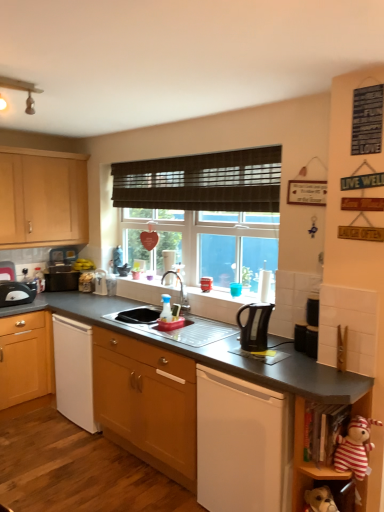
How much space does black plastic toaster at left, the 1th kitchen appliance in the back-to-front sequence, occupy horizontally?

black plastic toaster at left, the 1th kitchen appliance in the back-to-front sequence, is 7.88 inches in width.

This screenshot has height=512, width=384. I want to click on black plastic toaster at left, which ranks as the second kitchen appliance in front-to-back order, so click(16, 293).

The height and width of the screenshot is (512, 384). I want to click on black plastic toaster at left, which ranks as the first appliance in left-to-right order, so click(x=61, y=278).

The image size is (384, 512). Describe the element at coordinates (303, 444) in the screenshot. I see `wooden shelf at lower right, which appears as the second shelf when ordered from the bottom` at that location.

Describe the element at coordinates (242, 444) in the screenshot. I see `black plastic kettle at center` at that location.

This screenshot has width=384, height=512. What do you see at coordinates (355, 447) in the screenshot? I see `striped fabric stuffed animal at lower right` at bounding box center [355, 447].

Find the location of `wooden cabinet at center, the first cabinetry in the bottom-to-top sequence`. wooden cabinet at center, the first cabinetry in the bottom-to-top sequence is located at coordinates (147, 402).

The height and width of the screenshot is (512, 384). I want to click on black plastic toaster at left, which ranks as the second kitchen appliance in front-to-back order, so click(16, 293).

How different are the orientations of black plastic toaster at left, which ranks as the 2th kitchen appliance in right-to-left order, and striped fabric stuffed animal at lower right, which is the 1th shelf from bottom to top, in degrees?

89.5 degrees.

In terms of height, does black plastic toaster at left, which ranks as the second kitchen appliance in front-to-back order, look taller or shorter compared to striped fabric stuffed animal at lower right, which ranks as the 2th shelf in top-to-bottom order?

Considering their sizes, black plastic toaster at left, which ranks as the second kitchen appliance in front-to-back order, has less height than striped fabric stuffed animal at lower right, which ranks as the 2th shelf in top-to-bottom order.

From the striped fabric stuffed animal at lower right, which ranks as the 2th shelf in top-to-bottom order, count 2nd kitchen appliances backward and point to it. Please provide its 2D coordinates.

[(16, 293)]

Considering the positions of point (18, 287) and point (337, 483), is point (18, 287) closer or farther from the camera than point (337, 483)?

Point (18, 287).

From a real-world perspective, is brown woven blind at center above or below black plastic toaster at left, which ranks as the 2th kitchen appliance in right-to-left order?

brown woven blind at center is above black plastic toaster at left, which ranks as the 2th kitchen appliance in right-to-left order.

Is brown woven blind at center in contact with black plastic toaster at left, which ranks as the second kitchen appliance in front-to-back order?

There is a gap between brown woven blind at center and black plastic toaster at left, which ranks as the second kitchen appliance in front-to-back order.

Is brown woven blind at center taller or shorter than black plastic toaster at left, the 1th kitchen appliance in the back-to-front sequence?

Considering their sizes, brown woven blind at center has more height than black plastic toaster at left, the 1th kitchen appliance in the back-to-front sequence.

Is silver metallic tap at center wider than black plastic kettle at center, marked as the 1th kitchen appliance in a right-to-left arrangement?

Incorrect, the width of silver metallic tap at center does not surpass that of black plastic kettle at center, marked as the 1th kitchen appliance in a right-to-left arrangement.

Looking at the image, does silver metallic tap at center seem bigger or smaller compared to black plastic kettle at center, marked as the 1th kitchen appliance in a right-to-left arrangement?

Clearly, silver metallic tap at center is larger in size than black plastic kettle at center, marked as the 1th kitchen appliance in a right-to-left arrangement.

Considering the relative positions of silver metallic tap at center and black plastic kettle at center, the second kitchen appliance positioned from the back, in the image provided, is silver metallic tap at center to the right of black plastic kettle at center, the second kitchen appliance positioned from the back, from the viewer's perspective?

No.

Is point (295, 339) closer to camera compared to point (300, 488)?

No, it is behind (300, 488).

Is black plastic kettle at center, which is counted as the 1th appliance, starting from the right, positioned with its back to striped fabric stuffed animal at lower right, which ranks as the 2th shelf in top-to-bottom order?

black plastic kettle at center, which is counted as the 1th appliance, starting from the right, is not turned away from striped fabric stuffed animal at lower right, which ranks as the 2th shelf in top-to-bottom order.

Is black plastic kettle at center, which is counted as the 1th appliance, starting from the right, positioned behind striped fabric stuffed animal at lower right, which ranks as the 2th shelf in top-to-bottom order?

Yes.

From a real-world perspective, which shelf is the 2nd one underneath the black plastic kettle at center, marked as the 1th appliance in a bottom-to-top arrangement? Please provide its 2D coordinates.

[(325, 484)]

Considering their positions, is wooden shelf at lower right, which appears as the second shelf when ordered from the bottom, located in front of or behind black plastic toaster at left, marked as the 2th appliance in a right-to-left arrangement?

Clearly, wooden shelf at lower right, which appears as the second shelf when ordered from the bottom, is in front of black plastic toaster at left, marked as the 2th appliance in a right-to-left arrangement.

Would you say wooden shelf at lower right, which ranks as the 1th shelf in top-to-bottom order, contains black plastic toaster at left, marked as the 2th appliance in a right-to-left arrangement?

That's incorrect, black plastic toaster at left, marked as the 2th appliance in a right-to-left arrangement, is not inside wooden shelf at lower right, which ranks as the 1th shelf in top-to-bottom order.

From a real-world perspective, is wooden shelf at lower right, which appears as the second shelf when ordered from the bottom, on black plastic toaster at left, which is counted as the first appliance, starting from the back?

Actually, wooden shelf at lower right, which appears as the second shelf when ordered from the bottom, is physically below black plastic toaster at left, which is counted as the first appliance, starting from the back, in the real world.

From the image's perspective, is black plastic toaster at left, positioned as the 1th appliance in top-to-bottom order, located beneath black plastic kettle at center, the first appliance when ordered from front to back?

No, from the image's perspective, black plastic toaster at left, positioned as the 1th appliance in top-to-bottom order, is not below black plastic kettle at center, the first appliance when ordered from front to back.

From their relative heights in the image, would you say black plastic toaster at left, which ranks as the first appliance in left-to-right order, is taller or shorter than black plastic kettle at center, marked as the 1th appliance in a bottom-to-top arrangement?

Considering their sizes, black plastic toaster at left, which ranks as the first appliance in left-to-right order, has more height than black plastic kettle at center, marked as the 1th appliance in a bottom-to-top arrangement.

Does point (47, 289) lie in front of point (296, 331)?

No, it is not.

Based on the photo, is black plastic kettle at center, which is counted as the second appliance, starting from the top, surrounded by black plastic toaster at left, acting as the 2th appliance starting from the bottom?

No, black plastic kettle at center, which is counted as the second appliance, starting from the top, is located outside of black plastic toaster at left, acting as the 2th appliance starting from the bottom.

Is black plastic toaster at left, arranged as the first kitchen appliance when viewed from the left, far from black plastic kettle at center, which is counted as the 1th appliance, starting from the right?

Yes, black plastic toaster at left, arranged as the first kitchen appliance when viewed from the left, is far from black plastic kettle at center, which is counted as the 1th appliance, starting from the right.

From a real-world perspective, which object rests below the other?

black plastic kettle at center, which is counted as the 1th appliance, starting from the right, is physically lower.

Considering the sizes of objects black plastic toaster at left, which ranks as the second kitchen appliance in front-to-back order, and black plastic kettle at center, marked as the 1th appliance in a bottom-to-top arrangement, in the image provided, who is taller, black plastic toaster at left, which ranks as the second kitchen appliance in front-to-back order, or black plastic kettle at center, marked as the 1th appliance in a bottom-to-top arrangement,?

black plastic toaster at left, which ranks as the second kitchen appliance in front-to-back order.

Considering the positions of point (2, 283) and point (302, 338), is point (2, 283) closer or farther from the camera than point (302, 338)?

Point (2, 283) appears to be farther away from the viewer than point (302, 338).

Starting from the black plastic toaster at left, the 1th kitchen appliance in the back-to-front sequence, which shelf is the 1st one to the right? Please provide its 2D coordinates.

[(325, 484)]

Image resolution: width=384 pixels, height=512 pixels. What are the coordinates of `the 2nd kitchen appliance below the brown woven blind at center (from a real-world perspective)` in the screenshot? It's located at (16, 293).

When comparing their distances from silver metallic tap at center, does wooden shelf at lower right, which ranks as the 1th shelf in top-to-bottom order, or black plastic kettle at center, marked as the 1th kitchen appliance in a right-to-left arrangement, seem closer?

black plastic kettle at center, marked as the 1th kitchen appliance in a right-to-left arrangement, is positioned closer to the anchor silver metallic tap at center.

Based on their spatial positions, is black plastic kettle at center, marked as the 1th kitchen appliance in a right-to-left arrangement, or wooden cabinet at left, acting as the 1th cabinetry starting from the top, closer to wooden shelf at lower right, which ranks as the 1th shelf in top-to-bottom order?

black plastic kettle at center, marked as the 1th kitchen appliance in a right-to-left arrangement.

Based on their spatial positions, is wooden cabinet at left, which ranks as the second cabinetry in bottom-to-top order, or satin silver sink at center closer to wooden shelf at lower right, which ranks as the 1th shelf in top-to-bottom order?

The object closer to wooden shelf at lower right, which ranks as the 1th shelf in top-to-bottom order, is satin silver sink at center.

Considering their positions, is silver metallic tap at center positioned closer to wooden shelf at lower right, which appears as the second shelf when ordered from the bottom, than brown woven blind at center?

silver metallic tap at center.

From the image, which object appears to be nearer to brown woven blind at center, wooden cabinet at center, which ranks as the second cabinetry in left-to-right order, or wooden shelf at lower right, which ranks as the 1th shelf in top-to-bottom order?

wooden cabinet at center, which ranks as the second cabinetry in left-to-right order.

When comparing their distances from silver metallic tap at center, does black plastic kettle at center, which ranks as the first kitchen appliance in front-to-back order, or black plastic kettle at center seem further?

black plastic kettle at center lies further to silver metallic tap at center than the other object.

When comparing their distances from black plastic kettle at center, which ranks as the second appliance in left-to-right order, does wooden cabinet at center, which appears as the second cabinetry when viewed from the back, or wooden shelf at lower right, which ranks as the 1th shelf in top-to-bottom order, seem closer?

wooden shelf at lower right, which ranks as the 1th shelf in top-to-bottom order, is positioned closer to the anchor black plastic kettle at center, which ranks as the second appliance in left-to-right order.

When comparing their distances from black plastic kettle at center, does striped fabric stuffed animal at lower right or wooden shelf at lower right, which appears as the second shelf when ordered from the bottom, seem further?

The object further to black plastic kettle at center is striped fabric stuffed animal at lower right.

Identify the location of tap between brown woven blind at center and black plastic kettle at center vertically. pyautogui.click(x=180, y=291).

Find the location of `sink between brown woven blind at center and striped fabric stuffed animal at lower right, which ranks as the 2th shelf in top-to-bottom order, from top to bottom`. sink between brown woven blind at center and striped fabric stuffed animal at lower right, which ranks as the 2th shelf in top-to-bottom order, from top to bottom is located at coordinates (201, 332).

Where is `tap between satin silver sink at center and black plastic kettle at center, which is counted as the 1th appliance, starting from the right, from left to right`? Image resolution: width=384 pixels, height=512 pixels. tap between satin silver sink at center and black plastic kettle at center, which is counted as the 1th appliance, starting from the right, from left to right is located at coordinates coord(180,291).

At what (x,y) coordinates should I click in order to perform the action: click on sink between striped fabric stuffed animal at lower right and silver metallic tap at center along the z-axis. Please return your answer as a coordinate pair (x, y). Looking at the image, I should click on (201, 332).